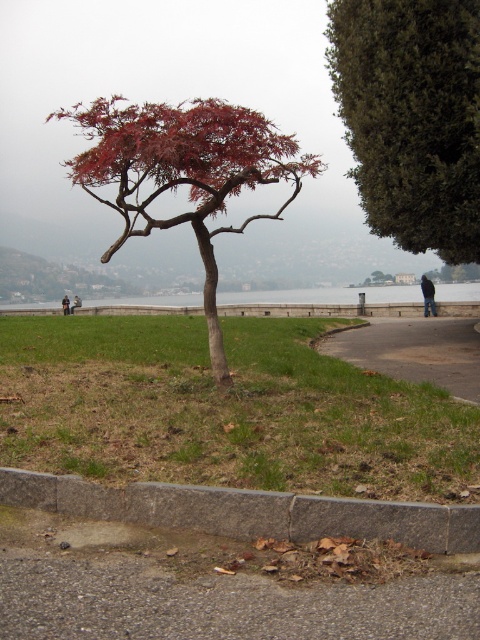
Question: Considering the real-world distances, which object is closest to the dirt/gravel path at lower center?

Choices:
 (A) shiny red maple at center
 (B) dark blue jacket at lower right
 (C) dark blue jeans at center

Answer: (A)

Question: Is gray water at center to the right of dark blue jeans at center from the viewer's perspective?

Choices:
 (A) yes
 (B) no

Answer: (A)

Question: Among these points, which one is farthest from the camera?

Choices:
 (A) (64, 308)
 (B) (99, 433)
 (C) (428, 305)
 (D) (227, 298)

Answer: (D)

Question: Estimate the real-world distances between objects in this image. Which object is farther from the gray concrete curb at lower center?

Choices:
 (A) green grass at lower center
 (B) dark blue jacket at lower right
 (C) dark blue jeans at center
 (D) dirt/gravel path at lower center

Answer: (C)

Question: Does green fuzzy bush at upper right have a greater width compared to dark blue jacket at lower right?

Choices:
 (A) no
 (B) yes

Answer: (B)

Question: Does gray concrete curb at lower center appear on the left side of dark blue jeans at center?

Choices:
 (A) no
 (B) yes

Answer: (A)